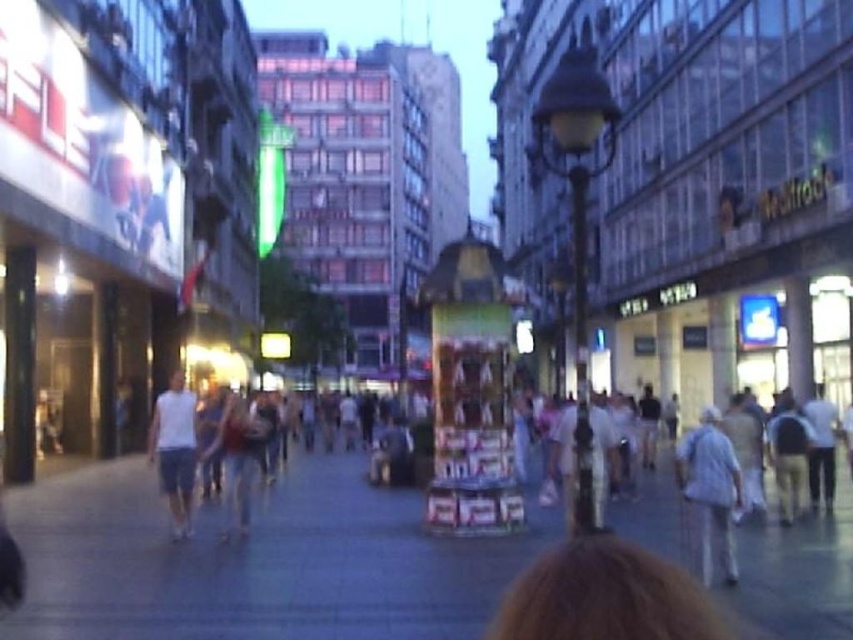
Locate an element on the screen. The width and height of the screenshot is (853, 640). white cotton shirt at lower right is located at coordinates (711, 486).

Which is in front, point (712, 451) or point (184, 490)?

Positioned in front is point (712, 451).

What do you see at coordinates (711, 486) in the screenshot? I see `white cotton shirt at lower right` at bounding box center [711, 486].

Image resolution: width=853 pixels, height=640 pixels. What are the coordinates of `white cotton shirt at lower right` in the screenshot? It's located at (711, 486).

Who is more forward, (332,548) or (183,499)?

Point (332,548)

Who is taller, gray concrete sidewalk at center or white cotton t-shirt at left?

Standing taller between the two is white cotton t-shirt at left.

Image resolution: width=853 pixels, height=640 pixels. Describe the element at coordinates (256, 561) in the screenshot. I see `gray concrete sidewalk at center` at that location.

Locate an element on the screen. The width and height of the screenshot is (853, 640). gray concrete sidewalk at center is located at coordinates click(256, 561).

Can you confirm if gray concrete sidewalk at center is positioned below white cotton shirt at lower right?

Indeed, gray concrete sidewalk at center is positioned under white cotton shirt at lower right.

Is gray concrete sidewalk at center behind white cotton shirt at lower right?

No, gray concrete sidewalk at center is in front of white cotton shirt at lower right.

Which is behind, point (158, 584) or point (735, 570)?

Positioned behind is point (735, 570).

Locate an element on the screen. gray concrete sidewalk at center is located at coordinates (256, 561).